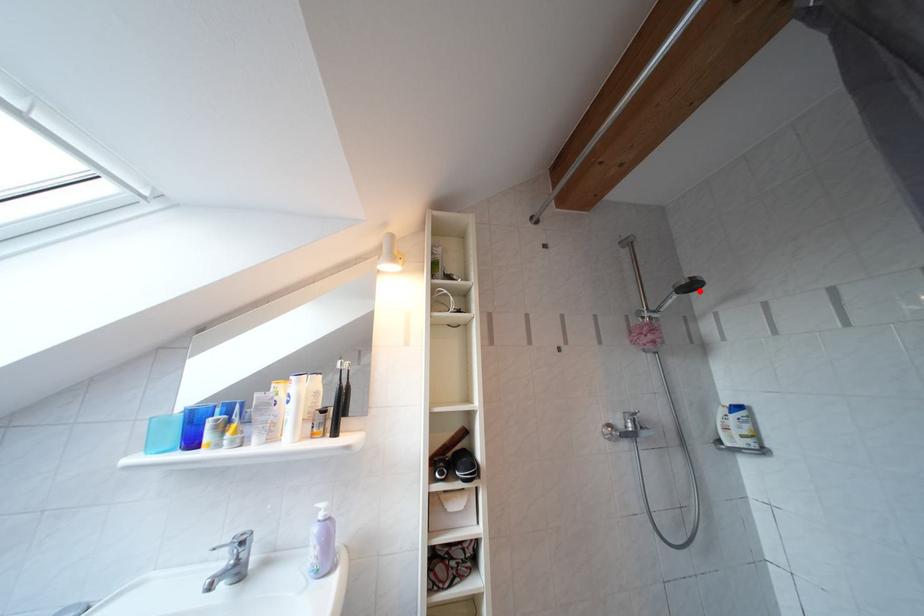
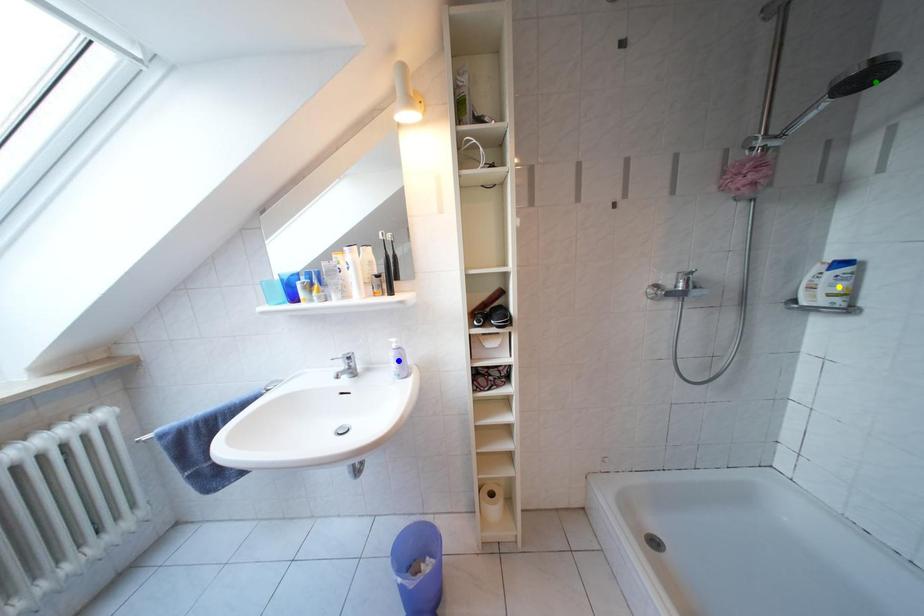
Question: I am providing you with two images of the same scene from different viewpoints. A red point is marked on the first image. You are given multiple points on the second image. Which point in image 2 represents the same 3d spot as the red point in image 1?

Choices:
 (A) yellow point
 (B) green point
 (C) blue point

Answer: (B)